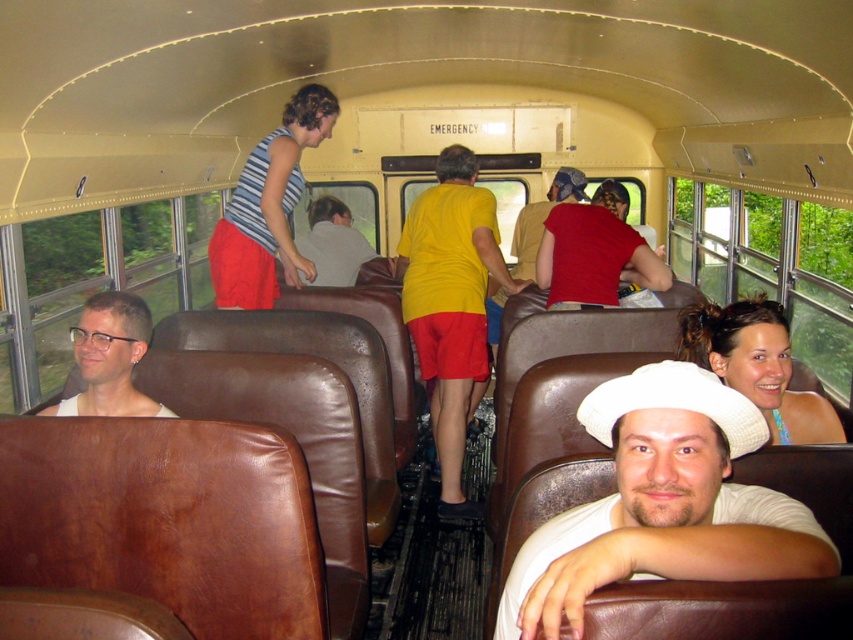
You are a passenger sitting in the vintage bus and want to take a photo of both the point at coordinates (x=596, y=403) and the point at coordinates (x=604, y=195). Which point should you focus on first to ensure both are in clear view?

You should focus on point (x=596, y=403) first since it is closer to the camera than point (x=604, y=195). This ensures both points will be in clear view as the camera adjusts depth of field.

You are sitting in the vintage bus and want to know which point is closer to you. The points are point (x=123, y=324) and point (x=334, y=209). Which point is closer to your current position?

Point (x=123, y=324) is in front of point (x=334, y=209), so it is closer to you.

You are a passenger on this vintage bus and want to take a photo of both the white matte hat at center and the matte red shirt at center. However, you can only focus on one object at a time. Which object should you focus on to ensure the other is still in the background?

You should focus on the white matte hat at center because it is closer to the viewer than the matte red shirt at center, so if you focus on it, the matte red shirt at center will be in the background and still in focus.